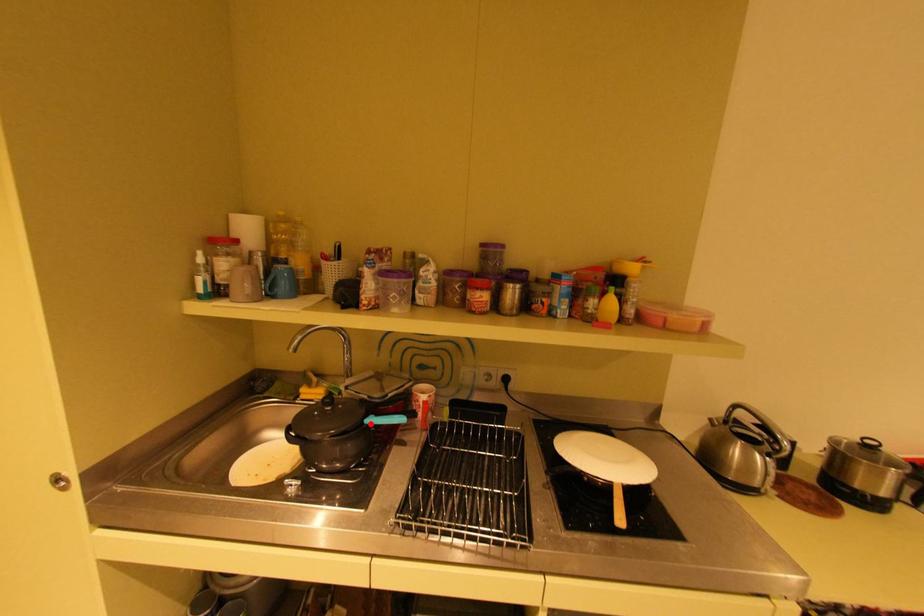
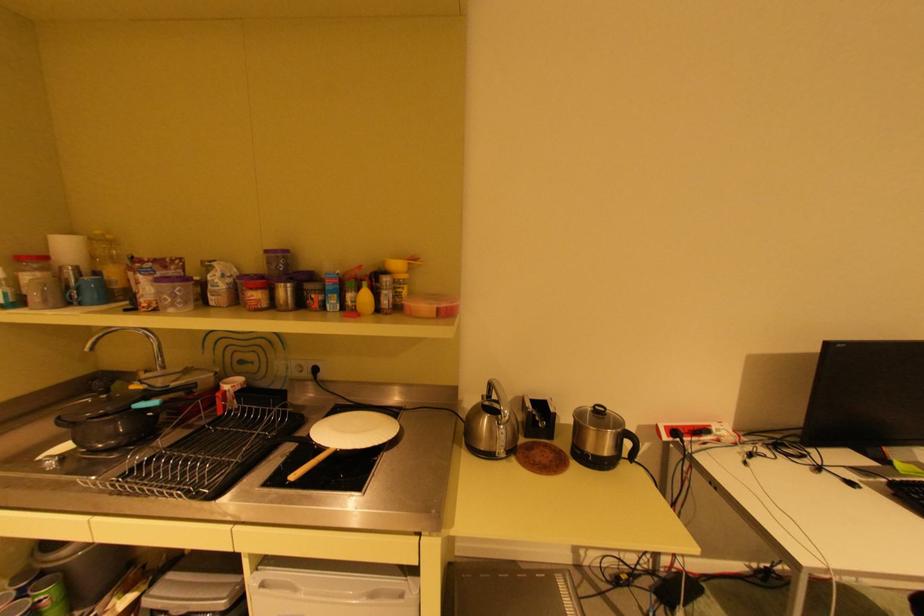
Where in the second image is the point corresponding to the highlighted location from the first image?

(139, 408)